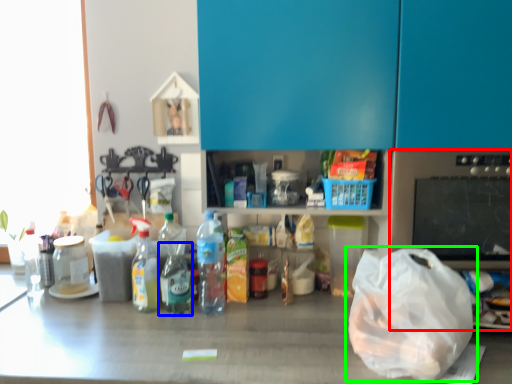
Question: Based on their relative distances, which object is nearer to appliance (highlighted by a red box)? Choose from bottle (highlighted by a blue box) and plastic bag (highlighted by a green box).

Choices:
 (A) bottle
 (B) plastic bag

Answer: (B)